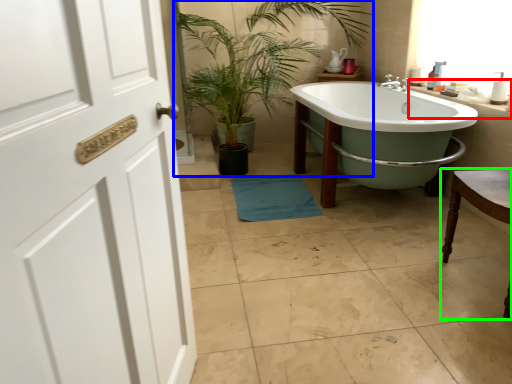
Question: Considering the real-world distances, which object is closest to counter top (highlighted by a red box)? houseplant (highlighted by a blue box) or chair (highlighted by a green box).

Choices:
 (A) houseplant
 (B) chair

Answer: (B)